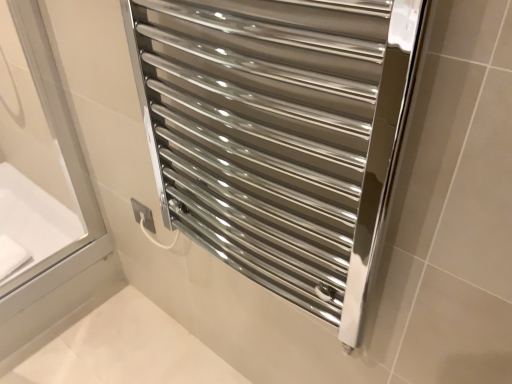
Locate an element on the screen. Image resolution: width=512 pixels, height=384 pixels. white glossy bathtub at left is located at coordinates click(x=33, y=220).

What do you see at coordinates (33, 220) in the screenshot? Image resolution: width=512 pixels, height=384 pixels. I see `white glossy bathtub at left` at bounding box center [33, 220].

At what (x,y) coordinates should I click in order to perform the action: click on polished chrome towel rack at center. Please return your answer as a coordinate pair (x, y). Looking at the image, I should click on (278, 134).

This screenshot has width=512, height=384. What do you see at coordinates (278, 134) in the screenshot? I see `polished chrome towel rack at center` at bounding box center [278, 134].

This screenshot has width=512, height=384. What are the coordinates of `white glossy bathtub at left` in the screenshot? It's located at (33, 220).

Considering the relative positions of polished chrome towel rack at center and white glossy bathtub at left in the image provided, is polished chrome towel rack at center to the left of white glossy bathtub at left from the viewer's perspective?

No, polished chrome towel rack at center is not to the left of white glossy bathtub at left.

Which object is closer to the camera, polished chrome towel rack at center or white glossy bathtub at left?

polished chrome towel rack at center is more forward.

Considering the positions of points (161, 134) and (19, 188), is point (161, 134) closer to camera compared to point (19, 188)?

That is True.

From the image's perspective, does polished chrome towel rack at center appear lower than white glossy bathtub at left?

No.

From a real-world perspective, relative to white glossy bathtub at left, is polished chrome towel rack at center vertically above or below?

In terms of real-world spatial position, polished chrome towel rack at center is above white glossy bathtub at left.

Between polished chrome towel rack at center and white glossy bathtub at left, which one has larger width?

white glossy bathtub at left is wider.

Based on the photo, is polished chrome towel rack at center taller or shorter than white glossy bathtub at left?

Clearly, polished chrome towel rack at center is taller compared to white glossy bathtub at left.

Considering the relative sizes of polished chrome towel rack at center and white glossy bathtub at left in the image provided, is polished chrome towel rack at center bigger than white glossy bathtub at left?

Yes.

Is polished chrome towel rack at center inside the boundaries of white glossy bathtub at left, or outside?

The correct answer is: outside.

Is polished chrome towel rack at center in contact with white glossy bathtub at left?

polished chrome towel rack at center is not next to white glossy bathtub at left, and they're not touching.

Is polished chrome towel rack at center turned away from white glossy bathtub at left?

That's not correct — polished chrome towel rack at center is not looking away from white glossy bathtub at left.

In the image, there is a polished chrome towel rack at center. Where is `bath below it (from a real-world perspective)`? bath below it (from a real-world perspective) is located at coordinates (33, 220).

Can you confirm if white glossy bathtub at left is positioned to the right of polished chrome towel rack at center?

No.

Which object is further away from the camera taking this photo, white glossy bathtub at left or polished chrome towel rack at center?

white glossy bathtub at left is more distant.

Which is nearer, (16, 181) or (314, 154)?

Point (16, 181).

From the image's perspective, is white glossy bathtub at left located above or below polished chrome towel rack at center?

white glossy bathtub at left is below polished chrome towel rack at center.

From a real-world perspective, who is located higher, white glossy bathtub at left or polished chrome towel rack at center?

polished chrome towel rack at center.

Does white glossy bathtub at left have a lesser width compared to polished chrome towel rack at center?

No, white glossy bathtub at left is not thinner than polished chrome towel rack at center.

Can you confirm if white glossy bathtub at left is shorter than polished chrome towel rack at center?

Yes, white glossy bathtub at left is shorter than polished chrome towel rack at center.

Consider the image. Is white glossy bathtub at left bigger or smaller than polished chrome towel rack at center?

white glossy bathtub at left is smaller than polished chrome towel rack at center.

Can we say white glossy bathtub at left lies outside polished chrome towel rack at center?

Yes, white glossy bathtub at left is outside of polished chrome towel rack at center.

Is white glossy bathtub at left far away from polished chrome towel rack at center?

No, white glossy bathtub at left is not far from polished chrome towel rack at center.

Is polished chrome towel rack at center at the back of white glossy bathtub at left?

No.

How different are the orientations of white glossy bathtub at left and polished chrome towel rack at center in degrees?

The angle between the facing direction of white glossy bathtub at left and the facing direction of polished chrome towel rack at center is 89.4 degrees.

I want to click on towel rack in front of the white glossy bathtub at left, so click(278, 134).

Identify the location of towel rack located above the white glossy bathtub at left (from a real-world perspective). The image size is (512, 384). (278, 134).

At what (x,y) coordinates should I click in order to perform the action: click on bath on the left of polished chrome towel rack at center. Please return your answer as a coordinate pair (x, y). The height and width of the screenshot is (384, 512). Looking at the image, I should click on (33, 220).